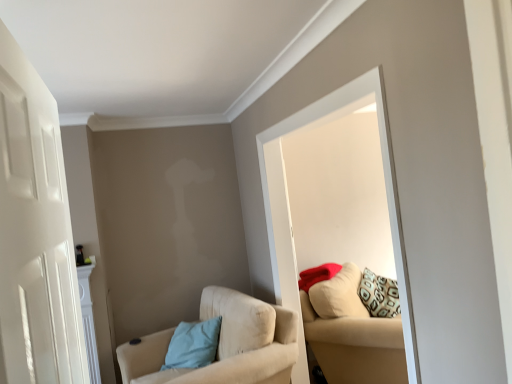
In order to face beige fabric chair at lower left, should I rotate leftwards or rightwards?

You should look left and rotate roughly 6.311 degrees.

The width and height of the screenshot is (512, 384). Describe the element at coordinates (385, 185) in the screenshot. I see `white glossy mirror at upper center` at that location.

Based on the photo, how much space does matte red pillow at upper right, marked as the 1th pillow in a right-to-left arrangement, occupy horizontally?

9.73 inches.

Locate an element on the screen. The height and width of the screenshot is (384, 512). white matte door at left is located at coordinates (35, 233).

The width and height of the screenshot is (512, 384). Describe the element at coordinates (35, 233) in the screenshot. I see `white matte door at left` at that location.

In order to click on light blue fabric pillow at lower left, the 1th pillow in the bottom-to-top sequence in this screenshot , I will do `click(193, 344)`.

Which point is more forward, [387,319] or [320,281]?

The point [387,319] is in front.

Considering the relative sizes of beige fabric couch at right and matte red pillow at upper right, marked as the 2th pillow in a left-to-right arrangement, in the image provided, is beige fabric couch at right smaller than matte red pillow at upper right, marked as the 2th pillow in a left-to-right arrangement,?

Incorrect, beige fabric couch at right is not smaller in size than matte red pillow at upper right, marked as the 2th pillow in a left-to-right arrangement.

Is beige fabric couch at right inside the boundaries of matte red pillow at upper right, which is the 1th pillow from top to bottom, or outside?

beige fabric couch at right is located beyond the bounds of matte red pillow at upper right, which is the 1th pillow from top to bottom.

Is white glossy mirror at upper center positioned with its back to light blue fabric pillow at lower left, the second pillow from the right?

No.

Which of these two, white glossy mirror at upper center or light blue fabric pillow at lower left, which ranks as the second pillow in top-to-bottom order, stands taller?

white glossy mirror at upper center.

Considering the sizes of objects white glossy mirror at upper center and light blue fabric pillow at lower left, the 1th pillow in the bottom-to-top sequence, in the image provided, who is bigger, white glossy mirror at upper center or light blue fabric pillow at lower left, the 1th pillow in the bottom-to-top sequence,?

With larger size is white glossy mirror at upper center.

Is white glossy mirror at upper center wider than light blue fabric pillow at lower left, the 1th pillow in the bottom-to-top sequence?

No.

Where is `window above the matte red pillow at upper right, marked as the 1th pillow in a right-to-left arrangement (from a real-world perspective)`? The image size is (512, 384). window above the matte red pillow at upper right, marked as the 1th pillow in a right-to-left arrangement (from a real-world perspective) is located at coordinates (385, 185).

Is matte red pillow at upper right, marked as the 2th pillow in a left-to-right arrangement, next to white glossy mirror at upper center?

matte red pillow at upper right, marked as the 2th pillow in a left-to-right arrangement, and white glossy mirror at upper center are clearly separated.

From the image's perspective, is matte red pillow at upper right, marked as the 1th pillow in a right-to-left arrangement, on white glossy mirror at upper center?

Incorrect, from the image's perspective, matte red pillow at upper right, marked as the 1th pillow in a right-to-left arrangement, is lower than white glossy mirror at upper center.

Would you say matte red pillow at upper right, marked as the 1th pillow in a right-to-left arrangement, is outside white glossy mirror at upper center?

Yes.

Looking at their sizes, would you say light blue fabric pillow at lower left, the 1th pillow in the bottom-to-top sequence, is wider or thinner than matte red pillow at upper right, marked as the 1th pillow in a right-to-left arrangement?

In the image, light blue fabric pillow at lower left, the 1th pillow in the bottom-to-top sequence, appears to be wider than matte red pillow at upper right, marked as the 1th pillow in a right-to-left arrangement.

Is light blue fabric pillow at lower left, which ranks as the second pillow in top-to-bottom order, far from matte red pillow at upper right, the 2th pillow ordered from the bottom?

light blue fabric pillow at lower left, which ranks as the second pillow in top-to-bottom order, is near matte red pillow at upper right, the 2th pillow ordered from the bottom, not far away.

Which of these two, light blue fabric pillow at lower left, the second pillow from the right, or matte red pillow at upper right, the 2th pillow ordered from the bottom, stands shorter?

With less height is matte red pillow at upper right, the 2th pillow ordered from the bottom.

Considering the points (170, 355) and (302, 278), which point is in front, point (170, 355) or point (302, 278)?

Positioned in front is point (170, 355).

From a real-world perspective, is white matte door at left physically above beige fabric couch at right?

Correct, in the physical world, white matte door at left is higher than beige fabric couch at right.

From the image's perspective, which one is positioned lower, white matte door at left or beige fabric couch at right?

beige fabric couch at right appears lower in the image.

From the image's perspective, is white glossy mirror at upper center under beige fabric chair at lower left?

Actually, white glossy mirror at upper center appears above beige fabric chair at lower left in the image.

Which of these two, white glossy mirror at upper center or beige fabric chair at lower left, stands shorter?

beige fabric chair at lower left is shorter.

Is white glossy mirror at upper center further to the viewer compared to beige fabric chair at lower left?

No, the depth of white glossy mirror at upper center is less than that of beige fabric chair at lower left.

You are a GUI agent. You are given a task and a screenshot of the screen. Output one action in this format:
    pyautogui.click(x=<x>, y=<y>)
    Task: Click on the chair below the white glossy mirror at upper center (from the image's perspective)
    This screenshot has height=384, width=512.
    Given the screenshot: What is the action you would take?
    pyautogui.click(x=224, y=344)

Does matte red pillow at upper right, the 2th pillow ordered from the bottom, touch white matte door at left?

No, matte red pillow at upper right, the 2th pillow ordered from the bottom, is not touching white matte door at left.

From the picture: From a real-world perspective, is matte red pillow at upper right, which is the 1th pillow from top to bottom, on top of white matte door at left?

No, from a real-world perspective, matte red pillow at upper right, which is the 1th pillow from top to bottom, is not over white matte door at left

From a real-world perspective, which pillow is the 2nd one above the beige fabric couch at right? Please provide its 2D coordinates.

[(317, 275)]

This screenshot has height=384, width=512. I want to click on the 2nd pillow positioned below the white glossy mirror at upper center (from a real-world perspective), so click(193, 344).

Based on their spatial positions, is beige fabric chair at lower left or white matte door at left further from beige fabric couch at right?

white matte door at left.

Based on the photo, which object lies further to the anchor point light blue fabric pillow at lower left, the 1th pillow in the bottom-to-top sequence, white matte door at left or beige fabric couch at right?

white matte door at left is further to light blue fabric pillow at lower left, the 1th pillow in the bottom-to-top sequence.

Considering their positions, is light blue fabric pillow at lower left, the second pillow from the right, positioned further to white glossy mirror at upper center than beige fabric chair at lower left?

light blue fabric pillow at lower left, the second pillow from the right.

From the image, which object appears to be nearer to matte red pillow at upper right, the 2th pillow ordered from the bottom, white glossy mirror at upper center or beige fabric couch at right?

Based on the image, beige fabric couch at right appears to be nearer to matte red pillow at upper right, the 2th pillow ordered from the bottom.

Which object lies further to the anchor point light blue fabric pillow at lower left, which is the first pillow from left to right, beige fabric couch at right or matte red pillow at upper right, marked as the 1th pillow in a right-to-left arrangement?

beige fabric couch at right.

Based on their spatial positions, is matte red pillow at upper right, marked as the 1th pillow in a right-to-left arrangement, or beige fabric chair at lower left closer to beige fabric couch at right?

matte red pillow at upper right, marked as the 1th pillow in a right-to-left arrangement, lies closer to beige fabric couch at right than the other object.

Consider the image. When comparing their distances from light blue fabric pillow at lower left, the 1th pillow in the bottom-to-top sequence, does white glossy mirror at upper center or matte red pillow at upper right, marked as the 2th pillow in a left-to-right arrangement, seem further?

Based on the image, matte red pillow at upper right, marked as the 2th pillow in a left-to-right arrangement, appears to be further to light blue fabric pillow at lower left, the 1th pillow in the bottom-to-top sequence.

Considering their positions, is matte red pillow at upper right, marked as the 2th pillow in a left-to-right arrangement, positioned closer to white matte door at left than beige fabric couch at right?

beige fabric couch at right lies closer to white matte door at left than the other object.

You are a GUI agent. You are given a task and a screenshot of the screen. Output one action in this format:
    pyautogui.click(x=<x>, y=<y>)
    Task: Click on the pillow between white glossy mirror at upper center and matte red pillow at upper right, which is the 1th pillow from top to bottom, along the z-axis
    This screenshot has height=384, width=512.
    Given the screenshot: What is the action you would take?
    pyautogui.click(x=193, y=344)

The height and width of the screenshot is (384, 512). I want to click on chair situated between light blue fabric pillow at lower left, which ranks as the second pillow in top-to-bottom order, and beige fabric couch at right from left to right, so pyautogui.click(x=224, y=344).

At what (x,y) coordinates should I click in order to perform the action: click on chair between white matte door at left and matte red pillow at upper right, the 2th pillow ordered from the bottom, along the z-axis. Please return your answer as a coordinate pair (x, y). The width and height of the screenshot is (512, 384). Looking at the image, I should click on (224, 344).

Locate an element on the screen. This screenshot has height=384, width=512. studio couch between white glossy mirror at upper center and matte red pillow at upper right, which is the 1th pillow from top to bottom, in the front-back direction is located at coordinates (351, 333).